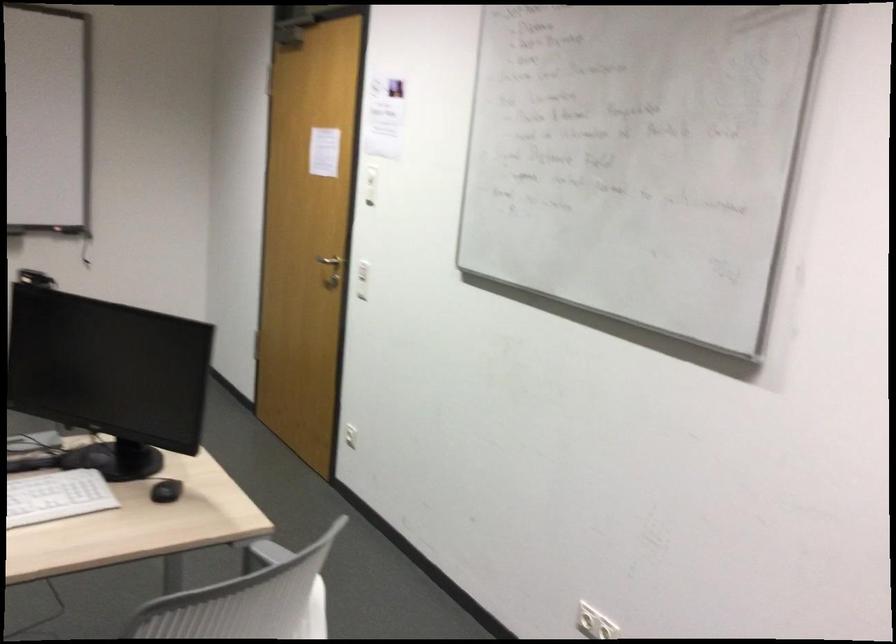
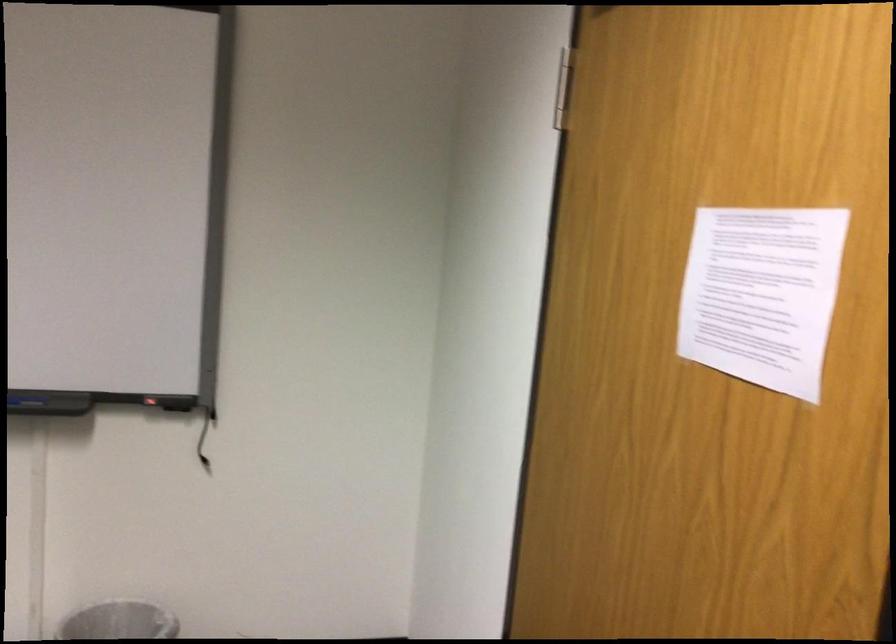
Question: Which direction would the cameraman need to move to produce the second image? Reply with the corresponding letter.

Choices:
 (A) Left
 (B) Right
 (C) Forward
 (D) Backward

Answer: (C)